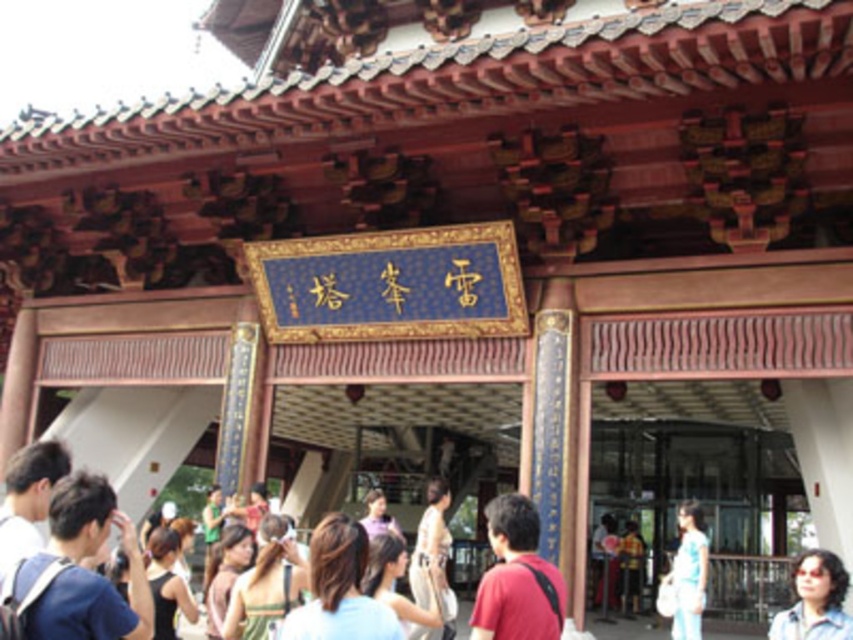
You are standing at the entrance of the traditional Chinese building and want to take a photo. There are two points marked in the scene, point 1 at coordinates point (422,513) and point 2 at coordinates point (173,579). Which point is closer to your camera?

Point (422,513) is further to the camera than point (173,579), so point (173,579) is closer to the camera.

You are a tourist visiting this traditional Chinese building and you have a blue fabric backpack at lower left and a matte white shirt at center. You want to take a photo of the entrance without any obstruction. Which object should you move to ensure the entrance is fully visible?

The blue fabric backpack at lower left is in front of the matte white shirt at center. To ensure the entrance is fully visible, you should move the blue fabric backpack at lower left out of the frame since it is blocking the view of the entrance.